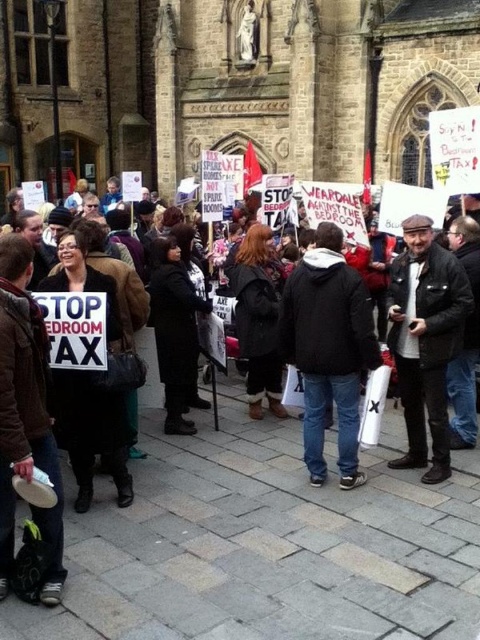
Question: Observing the image, what is the correct spatial positioning of black leather jacket at center in reference to dark blue jeans at center?

Choices:
 (A) below
 (B) above

Answer: (A)

Question: Which object is farther from the camera taking this photo?

Choices:
 (A) leather jacket at center
 (B) black leather coat at center

Answer: (B)

Question: Estimate the real-world distances between objects in this image. Which object is farther from the black leather coat at center?

Choices:
 (A) dark blue jeans at center
 (B) leather jacket at center
 (C) black leather jacket at center

Answer: (B)

Question: Can you confirm if black leather jacket at center is bigger than black leather coat at center?

Choices:
 (A) no
 (B) yes

Answer: (B)

Question: Can you confirm if black leather jacket at center is positioned to the right of dark blue jeans at center?

Choices:
 (A) no
 (B) yes

Answer: (A)

Question: Based on their relative distances, which object is nearer to the black leather coat at center?

Choices:
 (A) leather jacket at center
 (B) black leather jacket at center
 (C) dark blue jeans at center

Answer: (B)